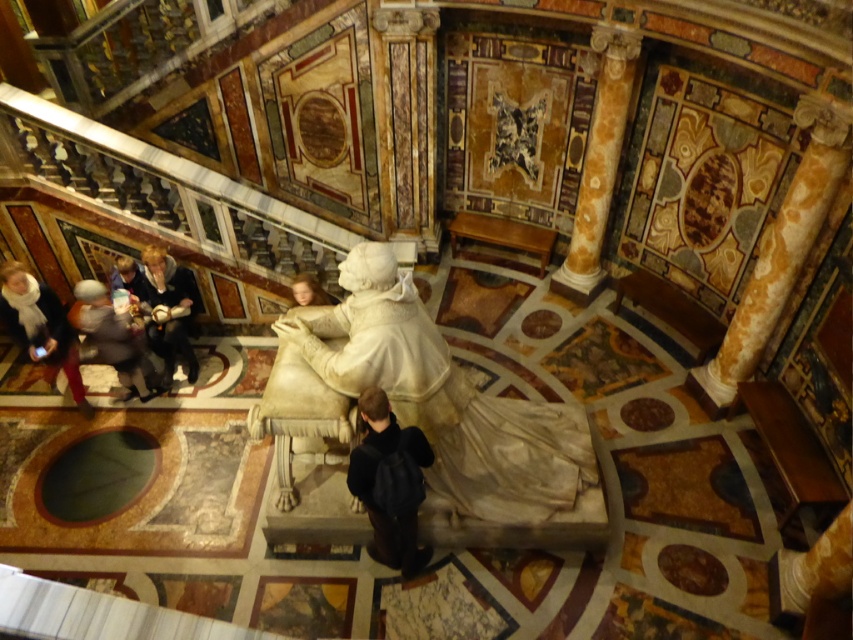
You are navigating through the ornate interior space and need to reach a specific location. If you are currently at point (396, 560), which direction should you move to reach point (540, 461)?

To reach point (540, 461) from point (396, 560), you should move backward since point (540, 461) is behind point (396, 560).

You are a visitor in this historical building and you want to place your black leather backpack at center and light brown leather jacket at center in a way that they are not too close to each other. Given that the minimum distance required between them is 10 feet, can you do that?

The black leather backpack at center and light brown leather jacket at center are 11.29 feet apart from each other, which exceeds the minimum required distance of 10 feet. Therefore, they are sufficiently spaced apart.